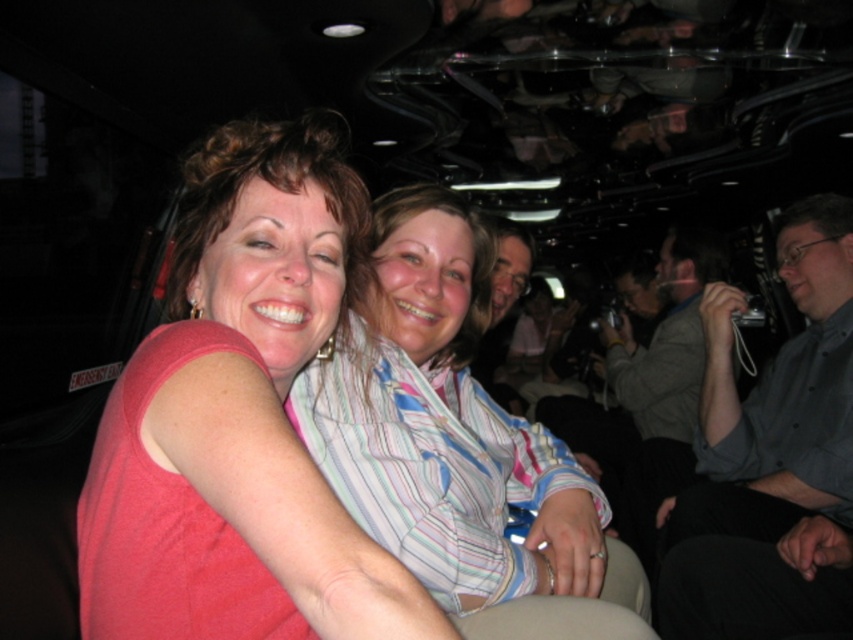
Does striped cotton shirt at center appear on the right side of smooth gray shirt at center?

Incorrect, striped cotton shirt at center is not on the right side of smooth gray shirt at center.

Which of these two, striped cotton shirt at center or smooth gray shirt at center, stands shorter?

With less height is smooth gray shirt at center.

Identify the location of striped cotton shirt at center. Image resolution: width=853 pixels, height=640 pixels. (457, 445).

Does point (213, 328) come farther from viewer compared to point (843, 508)?

No.

From the picture: Does matte pink shirt at center appear on the right side of gray button-down shirt at right?

In fact, matte pink shirt at center is to the left of gray button-down shirt at right.

Which is behind, point (196, 188) or point (786, 612)?

Positioned behind is point (786, 612).

This screenshot has width=853, height=640. I want to click on matte pink shirt at center, so click(239, 419).

Does matte pink shirt at center have a greater width compared to smooth gray shirt at center?

Result: Yes, matte pink shirt at center is wider than smooth gray shirt at center.

Does matte pink shirt at center have a lesser height compared to smooth gray shirt at center?

No.

Locate an element on the screen. The image size is (853, 640). matte pink shirt at center is located at coordinates (239, 419).